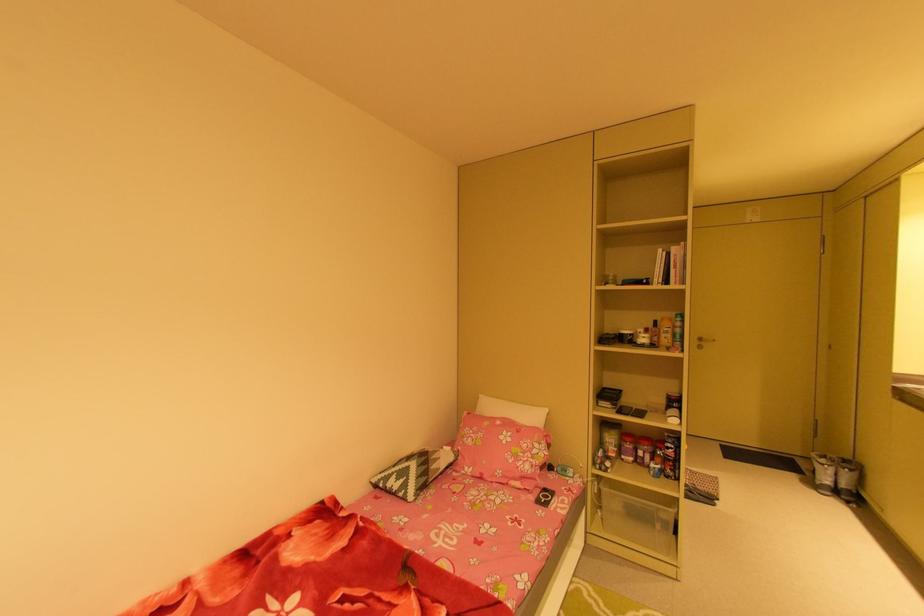
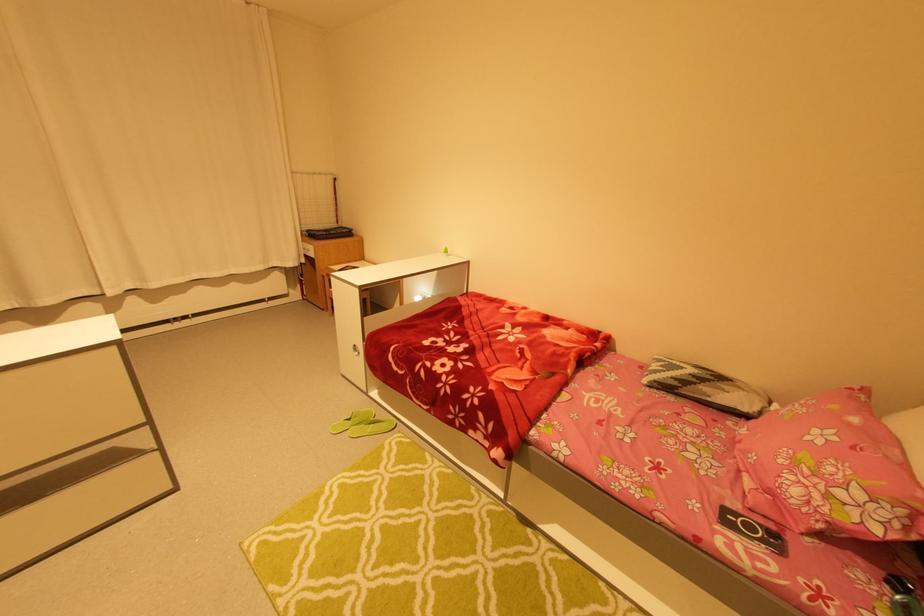
Find the pixel in the second image that matches pixel 548 446 in the first image.

(891, 515)